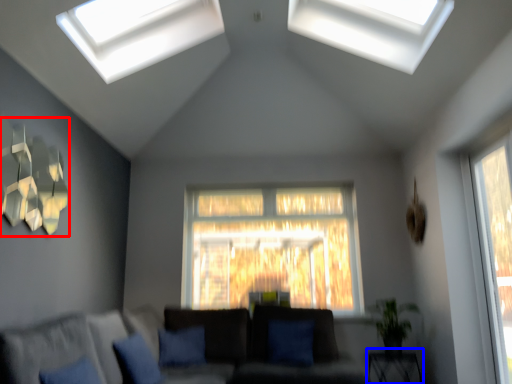
Question: Which point is closer to the camera, lamp (highlighted by a red box) or table (highlighted by a blue box)?

Choices:
 (A) lamp
 (B) table

Answer: (A)